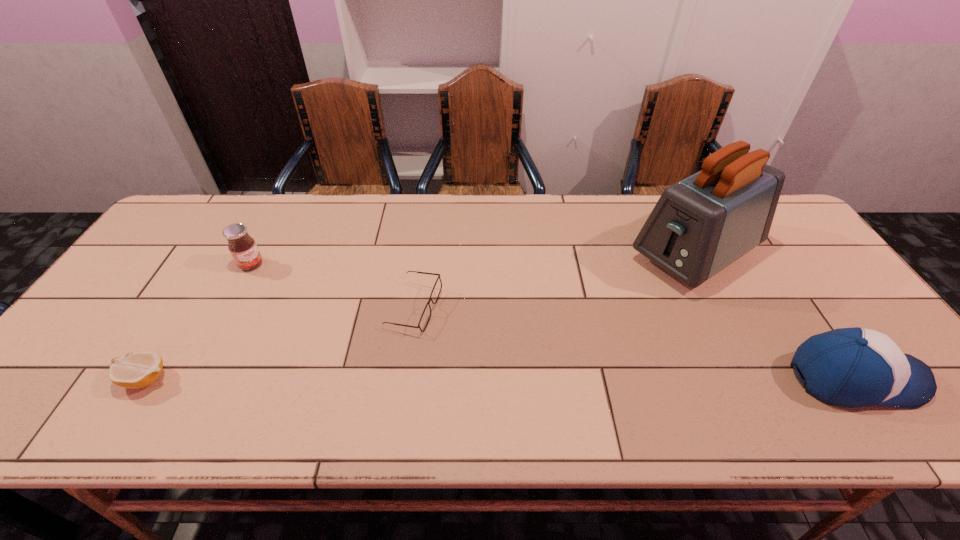
Where is `toaster that is at the right edge`? toaster that is at the right edge is located at coordinates (700, 225).

The width and height of the screenshot is (960, 540). Identify the location of object at the near left corner. (138, 369).

Image resolution: width=960 pixels, height=540 pixels. Identify the location of object at the far right corner. (700, 225).

The height and width of the screenshot is (540, 960). I want to click on object that is at the near right corner, so click(854, 367).

Where is `vacant space at the far edge of the desktop`? This screenshot has width=960, height=540. vacant space at the far edge of the desktop is located at coordinates (516, 215).

In the image, there is a desktop. At what (x,y) coordinates should I click in order to perform the action: click on vacant space at the near edge. Please return your answer as a coordinate pair (x, y). Looking at the image, I should click on (764, 389).

The image size is (960, 540). In order to click on blank space at the left edge in this screenshot , I will do `click(185, 278)`.

Find the location of a particular element. Image resolution: width=960 pixels, height=540 pixels. vacant area at the right edge is located at coordinates tap(796, 306).

Locate an element on the screen. The height and width of the screenshot is (540, 960). vacant area at the far left corner is located at coordinates (214, 232).

What are the coordinates of `free space between the baseball cap and the toaster` in the screenshot? It's located at (774, 317).